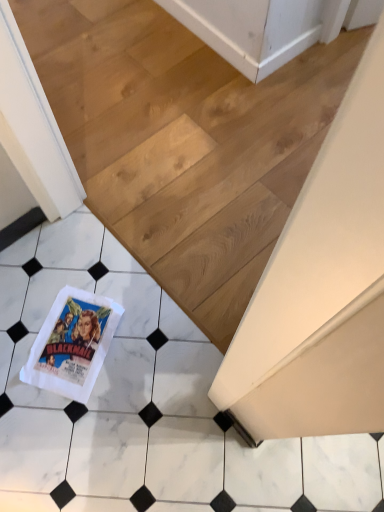
The width and height of the screenshot is (384, 512). I want to click on white paper towel at lower left, so click(x=72, y=344).

Measure the distance between white marble tile at lower left and camera.

A distance of 1.06 meters exists between white marble tile at lower left and camera.

Image resolution: width=384 pixels, height=512 pixels. Identify the location of white paper towel at lower left. (72, 344).

Considering the relative sizes of white marble tile at lower left and white marble tile at lower left in the image provided, is white marble tile at lower left smaller than white marble tile at lower left?

Correct, white marble tile at lower left occupies less space than white marble tile at lower left.

From the image's perspective, is white marble tile at lower left below white marble tile at lower left?

Yes, from the image's perspective, white marble tile at lower left is beneath white marble tile at lower left.

Is white marble tile at lower left at the back of white marble tile at lower left?

Yes.

Based on the photo, from a real-world perspective, relative to white paper towel at lower left, is white marble tile at lower left vertically above or below?

In terms of real-world spatial position, white marble tile at lower left is below white paper towel at lower left.

In the image, is white marble tile at lower left positioned in front of or behind white paper towel at lower left?

In the image, white marble tile at lower left appears in front of white paper towel at lower left.

Considering the positions of point (168, 500) and point (113, 301), is point (168, 500) closer or farther from the camera than point (113, 301)?

Point (168, 500) is positioned closer to the camera compared to point (113, 301).

Which of these two, white marble tile at lower left or white paper towel at lower left, is smaller?

white paper towel at lower left is smaller.

Is white marble tile at lower left far away from white marble tile at lower left?

They are positioned close to each other.

Which object is more forward, white marble tile at lower left or white marble tile at lower left?

white marble tile at lower left is more forward.

In terms of height, does white marble tile at lower left look taller or shorter compared to white marble tile at lower left?

white marble tile at lower left is taller than white marble tile at lower left.

How much distance is there between white paper towel at lower left and white marble tile at lower left?

They are 24.53 inches apart.

From the image's perspective, does white paper towel at lower left appear higher than white marble tile at lower left?

No.

Between white paper towel at lower left and white marble tile at lower left, which one has larger width?

white marble tile at lower left.

I want to click on stairwell located on the right of white paper towel at lower left, so click(184, 141).

How many degrees apart are the facing directions of white marble tile at lower left and white paper towel at lower left?

white marble tile at lower left and white paper towel at lower left are facing 61.6 degrees away from each other.

From a real-world perspective, is white marble tile at lower left physically located above or below white paper towel at lower left?

Clearly, from a real-world perspective, white marble tile at lower left is below white paper towel at lower left.

Which is in front, point (79, 135) or point (99, 347)?

The point (99, 347) is in front.

Considering the sizes of white marble tile at lower left and white paper towel at lower left in the image, is white marble tile at lower left wider or thinner than white paper towel at lower left?

white marble tile at lower left is wider than white paper towel at lower left.

Does white paper towel at lower left come behind white marble tile at lower left?

Yes, it is.

Consider the image. Considering the relative sizes of white paper towel at lower left and white marble tile at lower left in the image provided, is white paper towel at lower left taller than white marble tile at lower left?

No.

From a real-world perspective, which object rests below the other?

white marble tile at lower left is physically lower.

How many degrees apart are the facing directions of white paper towel at lower left and white marble tile at lower left?

The angle between the facing direction of white paper towel at lower left and the facing direction of white marble tile at lower left is 61.5 degrees.

This screenshot has height=512, width=384. In the image, there is a white marble tile at lower left. Find the location of `tile below it (from the image's perspective)`. tile below it (from the image's perspective) is located at coordinates (144, 404).

Identify the location of comic book positioned vertically above the white marble tile at lower left (from a real-world perspective). Image resolution: width=384 pixels, height=512 pixels. (72, 344).

Looking at the image, which one is located closer to white marble tile at lower left, white marble tile at lower left or white paper towel at lower left?

white paper towel at lower left is positioned closer to the anchor white marble tile at lower left.

Looking at the image, which one is located further to white marble tile at lower left, white paper towel at lower left or white marble tile at lower left?

white paper towel at lower left lies further to white marble tile at lower left than the other object.

When comparing their distances from white paper towel at lower left, does white marble tile at lower left or white marble tile at lower left seem further?

Based on the image, white marble tile at lower left appears to be further to white paper towel at lower left.

Based on their spatial positions, is white marble tile at lower left or white paper towel at lower left further from white marble tile at lower left?

The object further to white marble tile at lower left is white paper towel at lower left.

From the image, which object appears to be farther from white marble tile at lower left, white paper towel at lower left or white marble tile at lower left?

The object further to white marble tile at lower left is white marble tile at lower left.

When comparing their distances from white paper towel at lower left, does white marble tile at lower left or white marble tile at lower left seem further?

Based on the image, white marble tile at lower left appears to be further to white paper towel at lower left.

Identify the location of tile that lies between white marble tile at lower left and white paper towel at lower left from top to bottom. The image size is (384, 512). (144, 404).